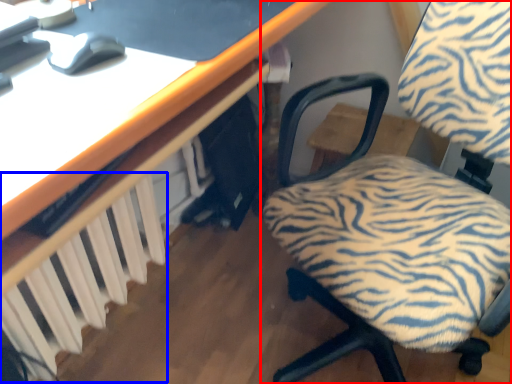
Question: Which point is further to the camera, chair (highlighted by a red box) or radiator (highlighted by a blue box)?

Choices:
 (A) chair
 (B) radiator

Answer: (B)